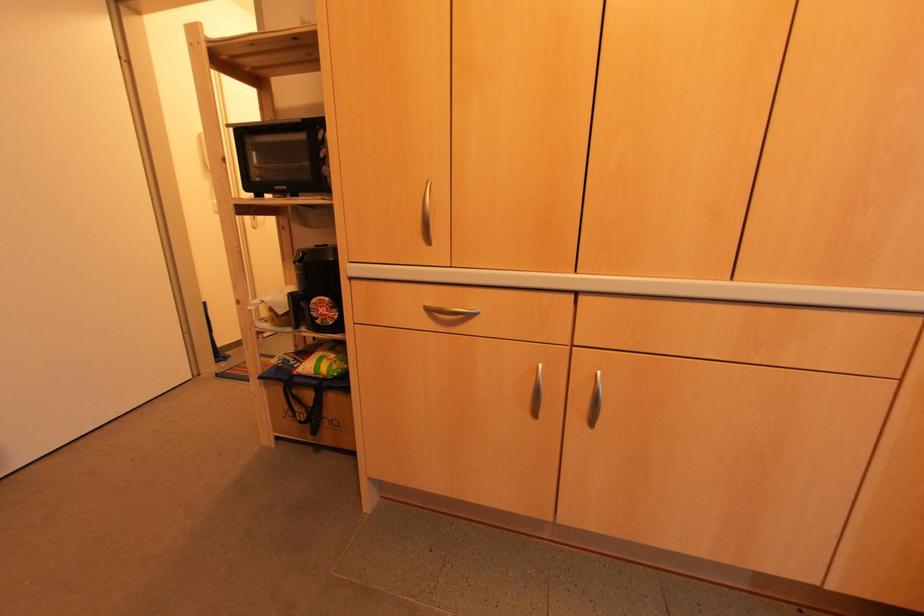
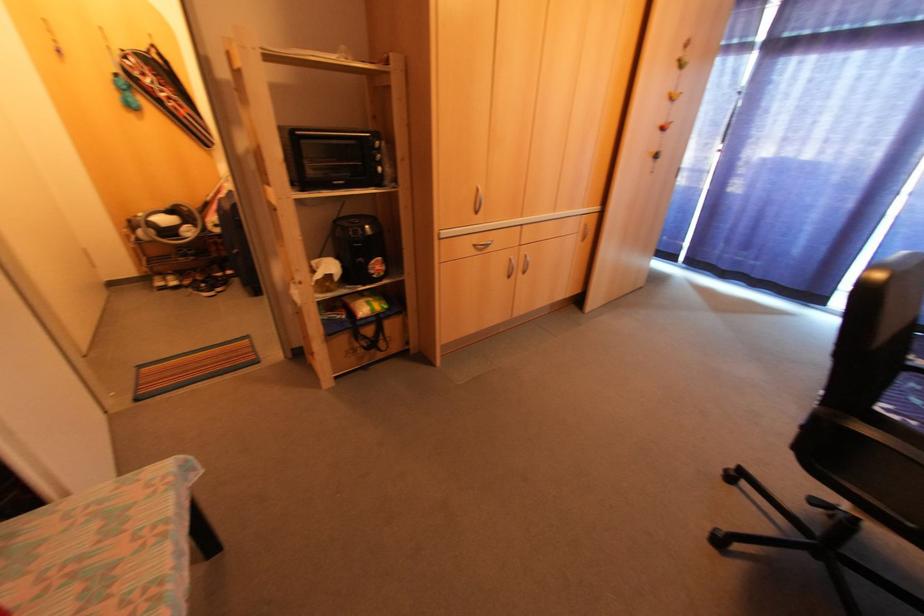
Find the pixel in the second image that matches pixel 274 188 in the first image.

(334, 184)